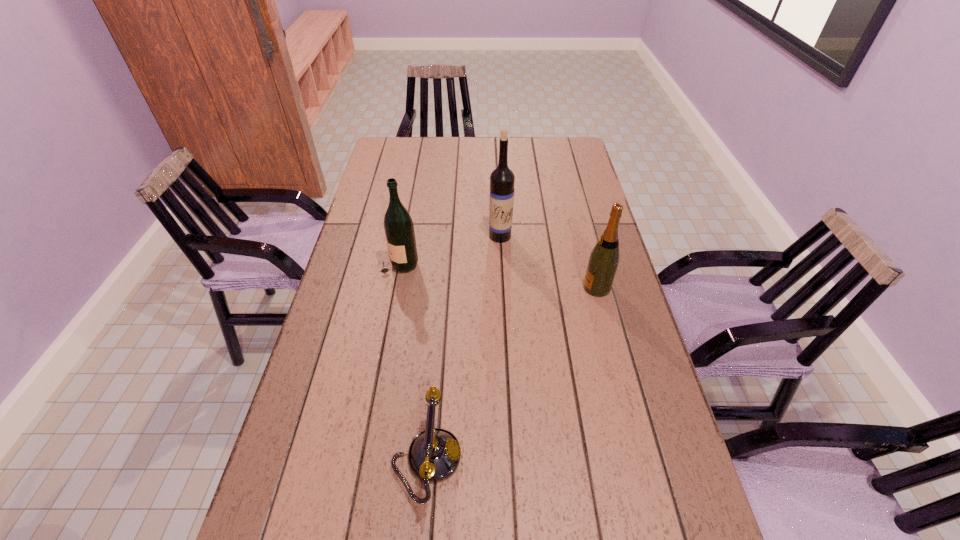
You are a GUI agent. You are given a task and a screenshot of the screen. Output one action in this format:
    pyautogui.click(x=<x>, y=<y>)
    Task: Click on the free location located 0.110m on the front-facing side of the nearest wine bottle
    
    Given the screenshot: What is the action you would take?
    pyautogui.click(x=545, y=287)

Where is `vacant space located on the front-facing side of the nearest wine bottle`? Image resolution: width=960 pixels, height=540 pixels. vacant space located on the front-facing side of the nearest wine bottle is located at coordinates (556, 287).

You are a GUI agent. You are given a task and a screenshot of the screen. Output one action in this format:
    pyautogui.click(x=<x>, y=<y>)
    Task: Click on the blank space located on the front-facing side of the nearest wine bottle
    This screenshot has width=960, height=540.
    Given the screenshot: What is the action you would take?
    pyautogui.click(x=539, y=287)

Where is `vacant space positioned on the dial of the nearest object`? vacant space positioned on the dial of the nearest object is located at coordinates pyautogui.click(x=504, y=459).

This screenshot has width=960, height=540. I want to click on object located at the left edge, so click(x=399, y=229).

You are a GUI agent. You are given a task and a screenshot of the screen. Output one action in this format:
    pyautogui.click(x=<x>, y=<y>)
    Task: Click on the object that is at the right edge
    The image size is (960, 540).
    Given the screenshot: What is the action you would take?
    pyautogui.click(x=603, y=262)

This screenshot has width=960, height=540. Identify the location of vacant area at the far edge. pyautogui.click(x=439, y=143).

The height and width of the screenshot is (540, 960). Identify the location of vacant position at the left edge of the desktop. (319, 495).

Image resolution: width=960 pixels, height=540 pixels. In order to click on blank space at the right edge of the desktop in this screenshot , I will do `click(650, 431)`.

The width and height of the screenshot is (960, 540). What are the coordinates of `unoccupied position between the shortest object and the second object from right to left` in the screenshot? It's located at (464, 348).